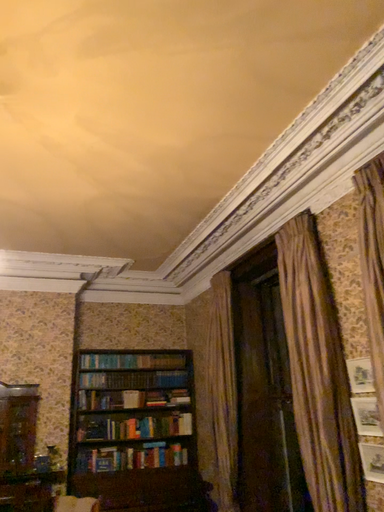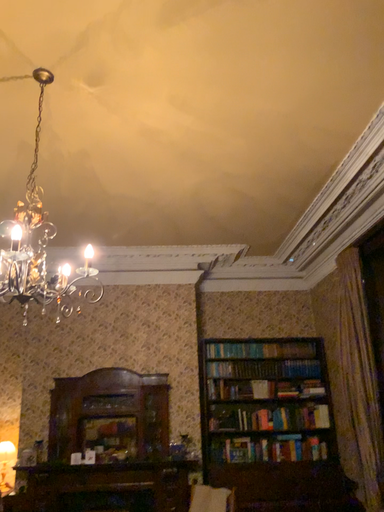
Question: How did the camera likely rotate when shooting the video?

Choices:
 (A) rotated right
 (B) rotated left

Answer: (B)